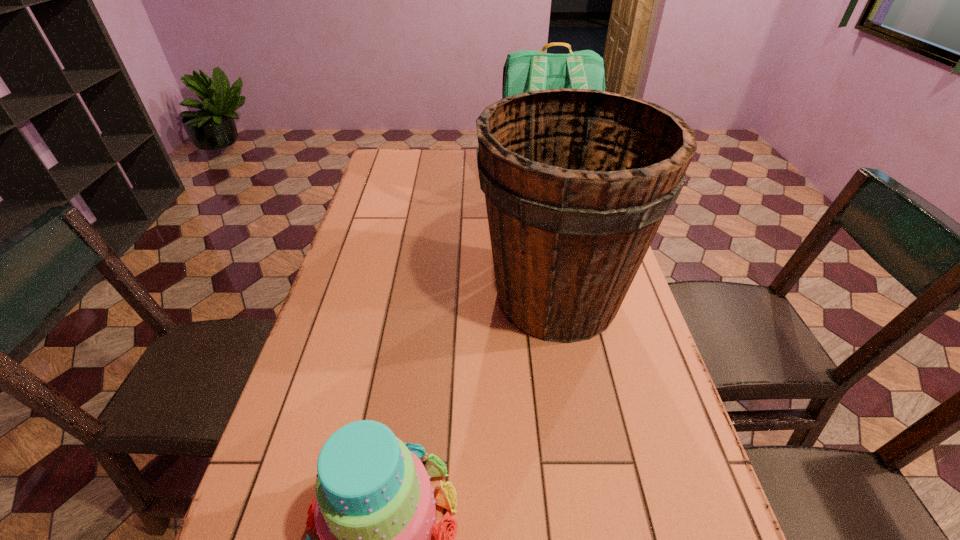
The image size is (960, 540). I want to click on blank space at the right edge of the desktop, so click(653, 413).

Identify which object is located as the nearest to the leftmost object. Please provide its 2D coordinates. Your answer should be formatted as a tuple, i.e. [(x, y)], where the tuple contains the x and y coordinates of a point satisfying the conditions above.

[(577, 182)]

Identify which object is the second closest to the bucket. Please provide its 2D coordinates. Your answer should be formatted as a tuple, i.e. [(x, y)], where the tuple contains the x and y coordinates of a point satisfying the conditions above.

[(375, 513)]